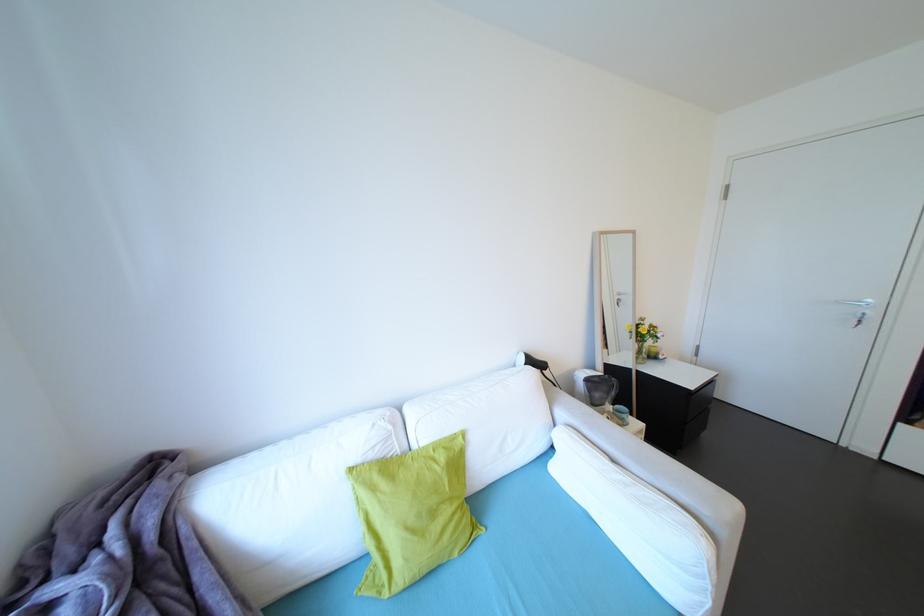
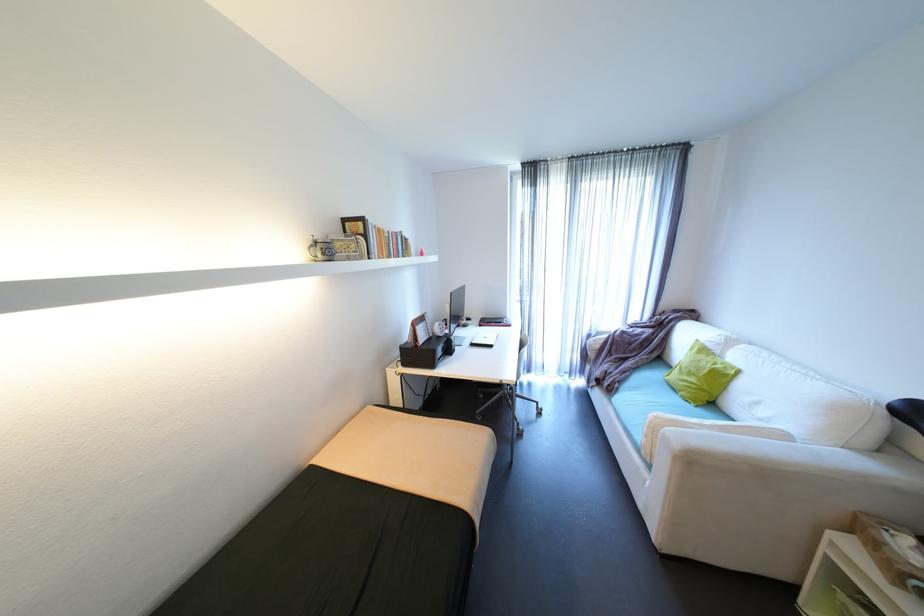
In the second image, find the point that corresponds to [470,435] in the first image.

(747, 371)